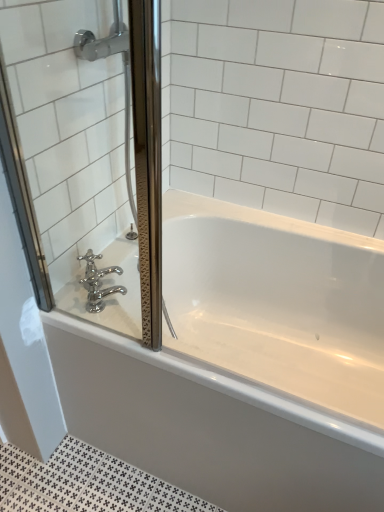
In order to click on free space to the right of polished chrome faucet at lower left in this screenshot , I will do `click(135, 314)`.